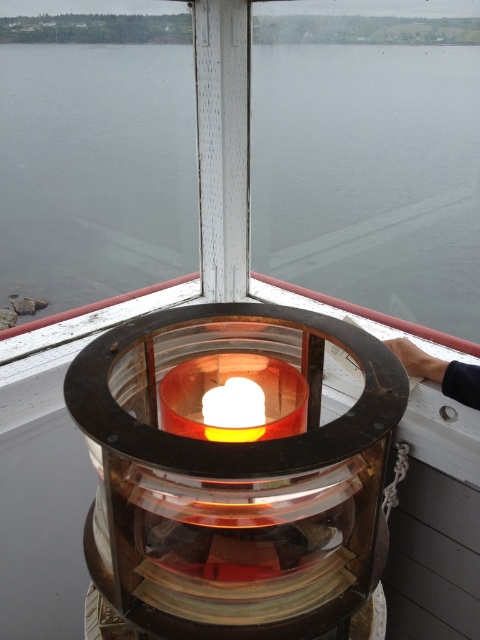
Can you confirm if transparent glass water at center is thinner than translucent glass candle at center?

No, transparent glass water at center is not thinner than translucent glass candle at center.

Which is more to the left, transparent glass water at center or translucent glass candle at center?

Positioned to the left is transparent glass water at center.

Is point (75, 285) positioned in front of point (183, 374)?

No, (75, 285) is behind (183, 374).

Image resolution: width=480 pixels, height=640 pixels. Identify the location of transparent glass water at center. (369, 157).

Between translucent glass candle at center and smooth skin hand at upper right, which one has more height?

smooth skin hand at upper right

Is point (263, 420) in front of point (472, 403)?

Yes, it is in front of point (472, 403).

Who is more distant from viewer, (299, 397) or (469, 368)?

Positioned behind is point (469, 368).

The image size is (480, 640). What are the coordinates of `translucent glass candle at center` in the screenshot? It's located at (233, 397).

Is translucent amber glass at center below smooth skin hand at upper right?

Yes, translucent amber glass at center is below smooth skin hand at upper right.

Does point (241, 534) lie behind point (464, 396)?

No, it is not.

Which is behind, point (317, 506) or point (432, 358)?

Positioned behind is point (432, 358).

Where is `translucent amber glass at center`? This screenshot has width=480, height=640. translucent amber glass at center is located at coordinates (233, 474).